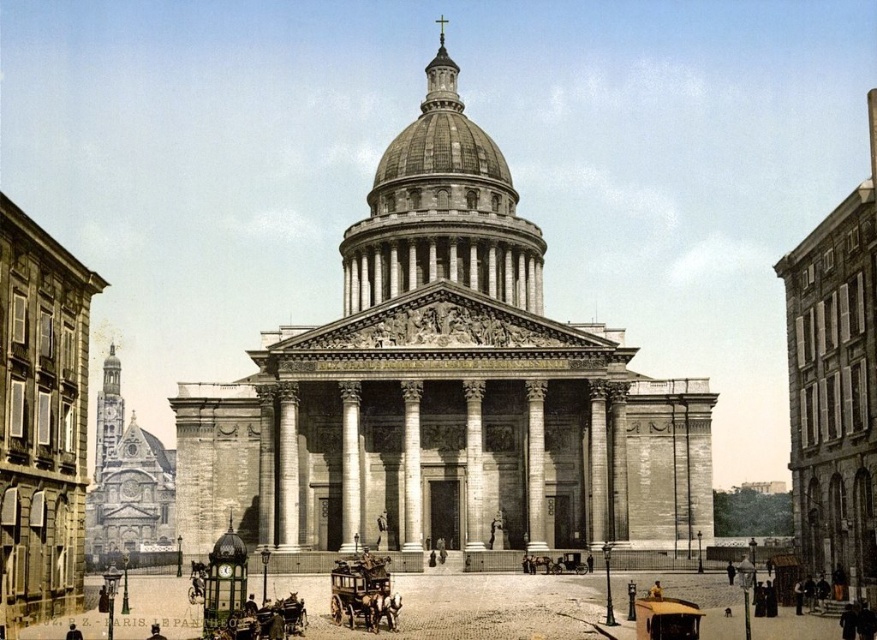
Question: Which object appears farthest from the camera in this image?

Choices:
 (A) wooden polished horse cart at center
 (B) stone cathedral at center

Answer: (B)

Question: Which of the following is the closest to the observer?

Choices:
 (A) (526, 257)
 (B) (361, 564)

Answer: (B)

Question: Is stone cathedral at center thinner than wooden polished horse cart at center?

Choices:
 (A) no
 (B) yes

Answer: (A)

Question: Is stone cathedral at center positioned at the back of wooden polished horse cart at center?

Choices:
 (A) yes
 (B) no

Answer: (A)

Question: Can you confirm if stone cathedral at center is smaller than wooden polished horse cart at center?

Choices:
 (A) yes
 (B) no

Answer: (B)

Question: Which object is closer to the camera taking this photo?

Choices:
 (A) wooden polished horse cart at center
 (B) stone cathedral at center

Answer: (A)